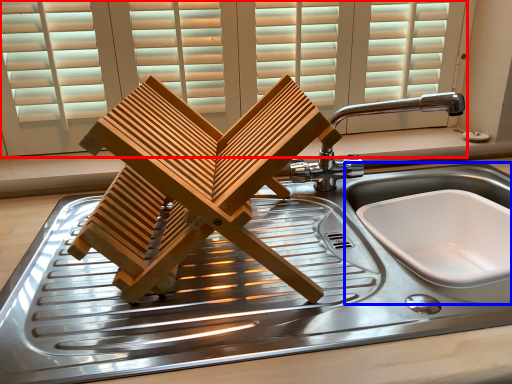
Question: Which of the following is the closest to the observer, window (highlighted by a red box) or sink (highlighted by a blue box)?

Choices:
 (A) window
 (B) sink

Answer: (B)